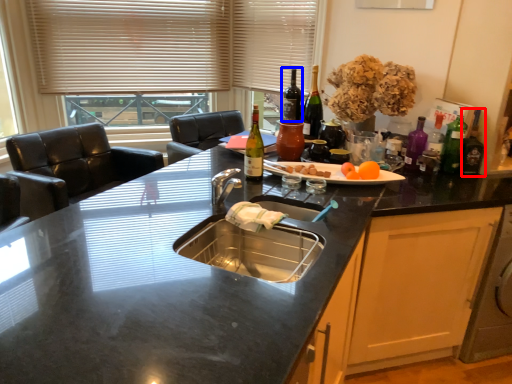
Question: Which point is closer to the camera, bottle (highlighted by a red box) or bottle (highlighted by a blue box)?

Choices:
 (A) bottle
 (B) bottle

Answer: (A)